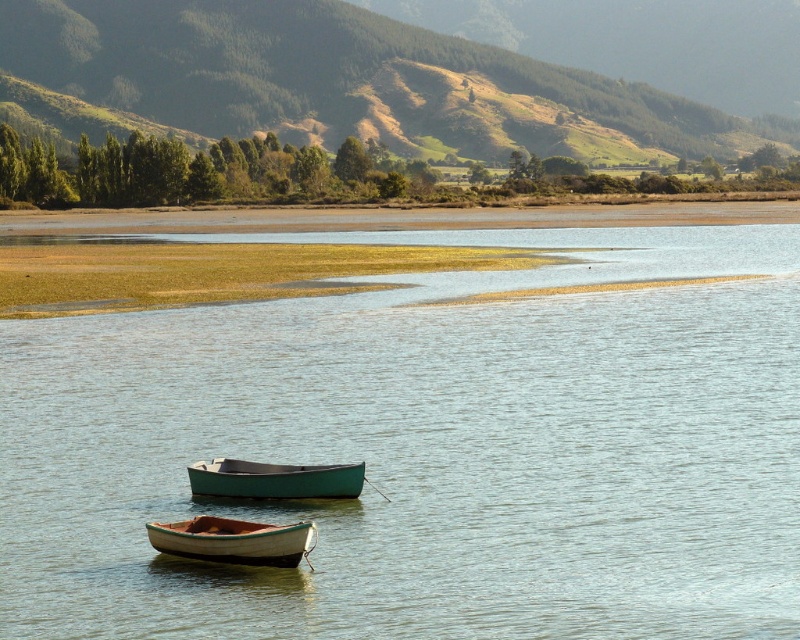
Does green wood boats at center have a lesser width compared to green grassy hillside at upper center?

Indeed, green wood boats at center has a lesser width compared to green grassy hillside at upper center.

Does green wood boats at center come behind green grassy hillside at upper center?

No, green wood boats at center is closer to the viewer.

Is point (364, 397) closer to camera compared to point (462, 150)?

Yes.

You are a GUI agent. You are given a task and a screenshot of the screen. Output one action in this format:
    pyautogui.click(x=<x>, y=<y>)
    Task: Click on the green wood boats at center
    This screenshot has height=640, width=800.
    Given the screenshot: What is the action you would take?
    pyautogui.click(x=428, y=448)

Looking at this image, which is below, green grassy hillside at upper center or green matte canoe at center?

Positioned lower is green matte canoe at center.

Does green grassy hillside at upper center have a lesser height compared to green matte canoe at center?

In fact, green grassy hillside at upper center may be taller than green matte canoe at center.

This screenshot has width=800, height=640. What are the coordinates of `green grassy hillside at upper center` in the screenshot? It's located at (352, 81).

How much distance is there between wooden canoe at lower center and green matte canoe at center?

A distance of 4.12 meters exists between wooden canoe at lower center and green matte canoe at center.

Find the location of `wooden canoe at lower center`. wooden canoe at lower center is located at coordinates (233, 540).

The width and height of the screenshot is (800, 640). What do you see at coordinates (233, 540) in the screenshot?
I see `wooden canoe at lower center` at bounding box center [233, 540].

Identify the location of wooden canoe at lower center. This screenshot has height=640, width=800. (233, 540).